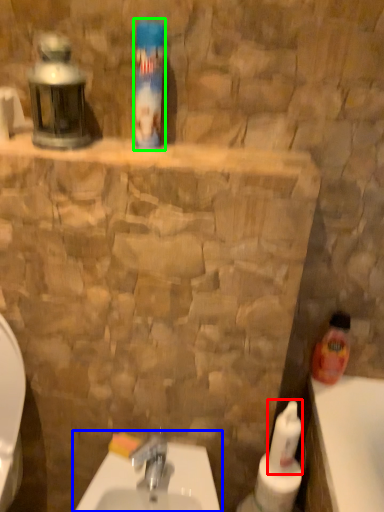
Question: Which object is positioned closest to cleaning product (highlighted by a red box)? Select from sink (highlighted by a blue box) and cleaning product (highlighted by a green box).

Choices:
 (A) sink
 (B) cleaning product

Answer: (A)